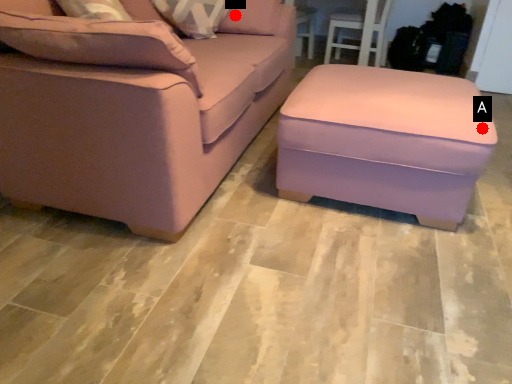
Question: Two points are circled on the image, labeled by A and B beside each circle. Which point is closer to the camera?

Choices:
 (A) A is closer
 (B) B is closer

Answer: (A)